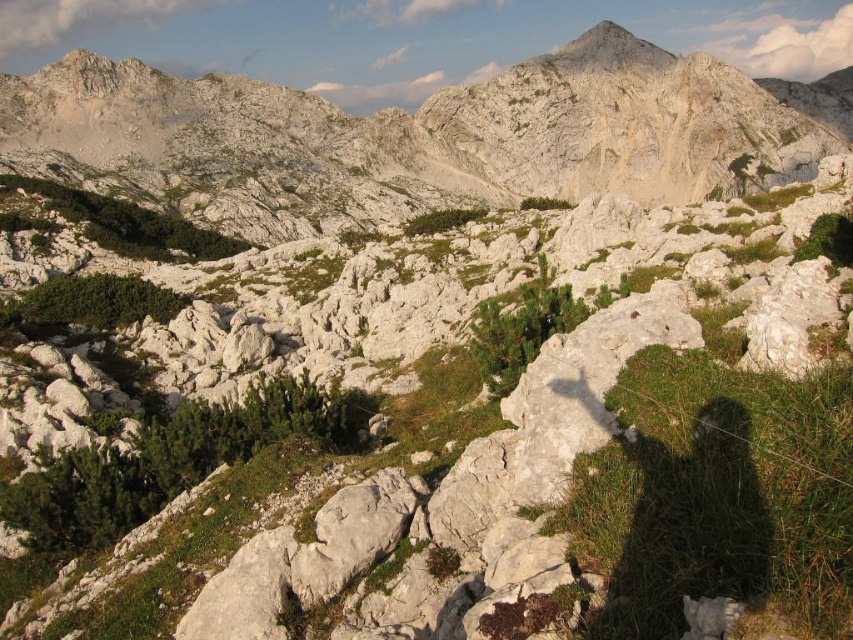
Measure the distance between point (x=786, y=131) and camera.

Point (x=786, y=131) and camera are 264.18 meters apart from each other.

Based on the photo, between white rocky mountain at center and smooth gray rock peak at upper center, which one is positioned higher?

smooth gray rock peak at upper center

Is point (91, 65) positioned before point (576, 67)?

Yes, point (91, 65) is closer to viewer.

What are the coordinates of `white rocky mountain at center` in the screenshot? It's located at point(415,140).